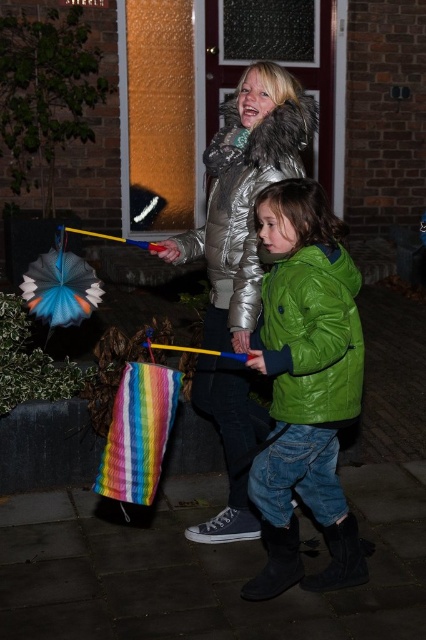
Question: Estimate the real-world distances between objects in this image. Which object is closer to the green shiny jacket at lower center?

Choices:
 (A) green matte jacket at center
 (B) multicolored fabric umbrella at center
 (C) silver metallic jacket at upper center

Answer: (A)

Question: Is green matte jacket at center wider than silver metallic jacket at upper center?

Choices:
 (A) no
 (B) yes

Answer: (A)

Question: Does silver metallic jacket at upper center have a lesser width compared to multicolored fabric umbrella at center?

Choices:
 (A) no
 (B) yes

Answer: (A)

Question: Is silver metallic jacket at upper center wider than green shiny jacket at lower center?

Choices:
 (A) yes
 (B) no

Answer: (A)

Question: Which of the following is the farthest from the observer?

Choices:
 (A) (239, 380)
 (B) (51, 301)
 (C) (319, 308)

Answer: (B)

Question: Among these objects, which one is nearest to the camera?

Choices:
 (A) multicolored fabric umbrella at center
 (B) green matte jacket at center
 (C) green shiny jacket at lower center
 (D) silver metallic jacket at upper center

Answer: (C)